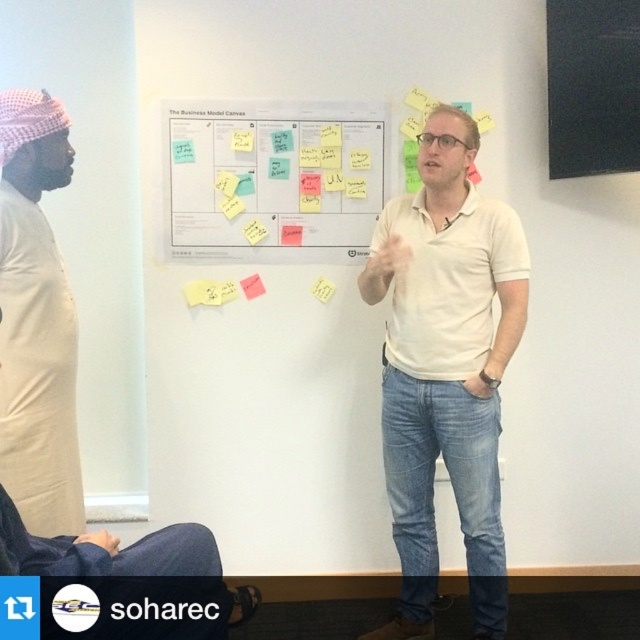
Question: Does beige cotton shirt at left come in front of black matte board at upper right?

Choices:
 (A) yes
 (B) no

Answer: (A)

Question: Based on their relative distances, which object is farther from the black matte board at upper right?

Choices:
 (A) yellow sticky note at upper center
 (B) white cotton shirt at center
 (C) white paperboard at center

Answer: (A)

Question: Among these points, which one is nearest to the camera?

Choices:
 (A) tap(506, 276)
 (B) tap(240, 131)

Answer: (A)

Question: Can you confirm if white cotton shirt at center is thinner than beige cotton shirt at left?

Choices:
 (A) no
 (B) yes

Answer: (A)

Question: Does yellow paper at center have a lesser width compared to yellow sticky note at upper center?

Choices:
 (A) no
 (B) yes

Answer: (A)

Question: Which of the following is the closest to the observer?

Choices:
 (A) white cotton shirt at center
 (B) yellow paper at center

Answer: (A)